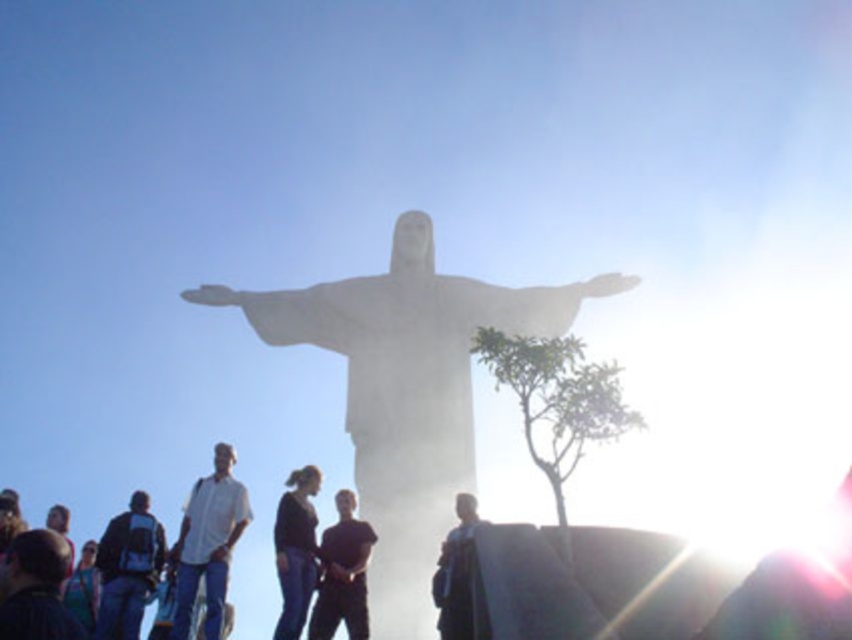
Question: Does white stone statue at center have a smaller size compared to matte black backpack at lower left?

Choices:
 (A) yes
 (B) no

Answer: (B)

Question: Estimate the real-world distances between objects in this image. Which object is closer to the white stone statue at center?

Choices:
 (A) dark blue jeans at lower left
 (B) black matte shirt at center
 (C) white matte shirt at center
 (D) matte black backpack at lower left

Answer: (B)

Question: Which point is farther to the camera?

Choices:
 (A) (326, 605)
 (B) (142, 502)

Answer: (B)

Question: Can you confirm if dark blue jeans at lower left is positioned to the left of black matte shirt at center?

Choices:
 (A) yes
 (B) no

Answer: (A)

Question: Which object is closer to the camera taking this photo?

Choices:
 (A) dark blue jeans at lower left
 (B) black matte shirt at center
 (C) white stone statue at center

Answer: (A)

Question: Can you confirm if white stone statue at center is wider than black matte shirt at center?

Choices:
 (A) no
 (B) yes

Answer: (B)